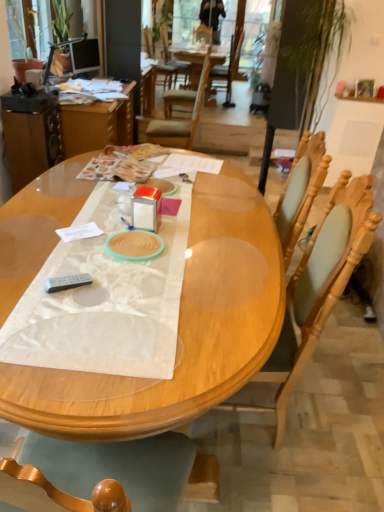
Identify the location of free space to the back side of gray matte remote control at lower left. (80, 261).